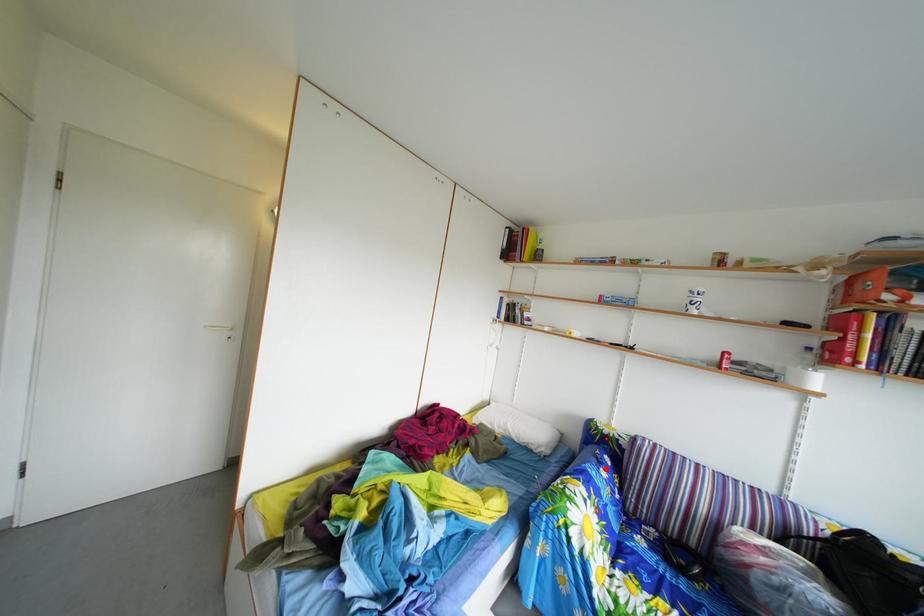
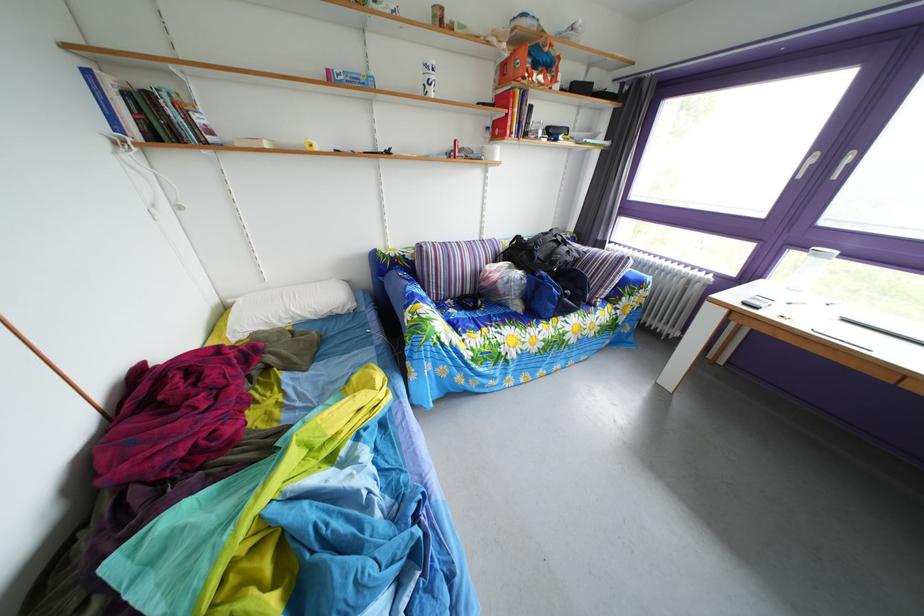
The point at the highlighted location is marked in the first image. Where is the corresponding point in the second image?

(417, 290)